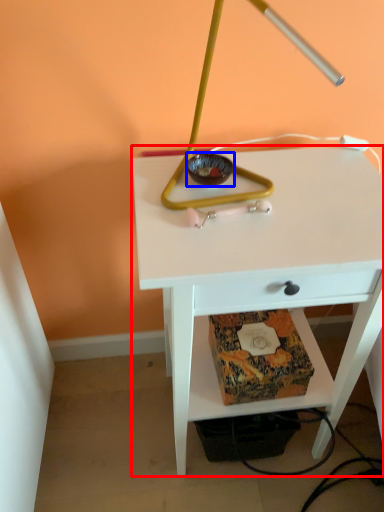
Question: Which of the following is the farthest to the observer, table (highlighted by a red box) or glass bowl (highlighted by a blue box)?

Choices:
 (A) table
 (B) glass bowl

Answer: (B)